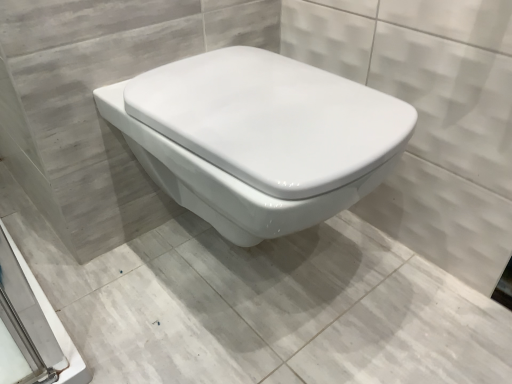
Locate an element on the screen. This screenshot has height=384, width=512. free spot above white glossy toilet at center (from a real-world perspective) is located at coordinates (220, 284).